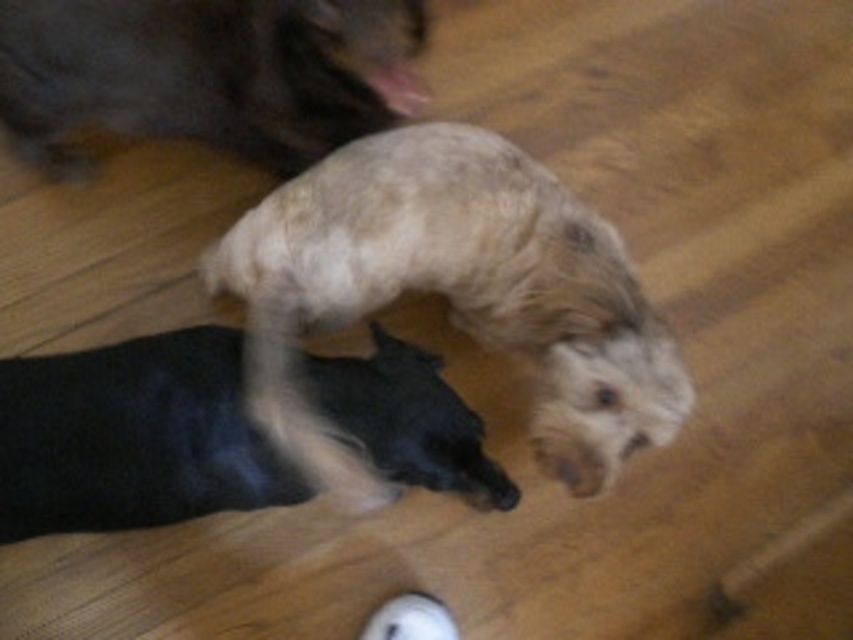
Question: Can you confirm if fluffy beige dog at center is positioned below soft brown fur at upper left?

Choices:
 (A) yes
 (B) no

Answer: (A)

Question: Does soft black dog at lower left appear over soft brown fur at upper left?

Choices:
 (A) no
 (B) yes

Answer: (A)

Question: Which point appears closest to the camera in this image?

Choices:
 (A) 47,84
 (B) 321,381

Answer: (B)

Question: Does fluffy beige dog at center appear on the right side of soft black dog at lower left?

Choices:
 (A) yes
 (B) no

Answer: (A)

Question: Estimate the real-world distances between objects in this image. Which object is closer to the soft brown fur at upper left?

Choices:
 (A) fluffy beige dog at center
 (B) soft black dog at lower left

Answer: (A)

Question: Which is nearer to the fluffy beige dog at center?

Choices:
 (A) soft black dog at lower left
 (B) soft brown fur at upper left

Answer: (A)